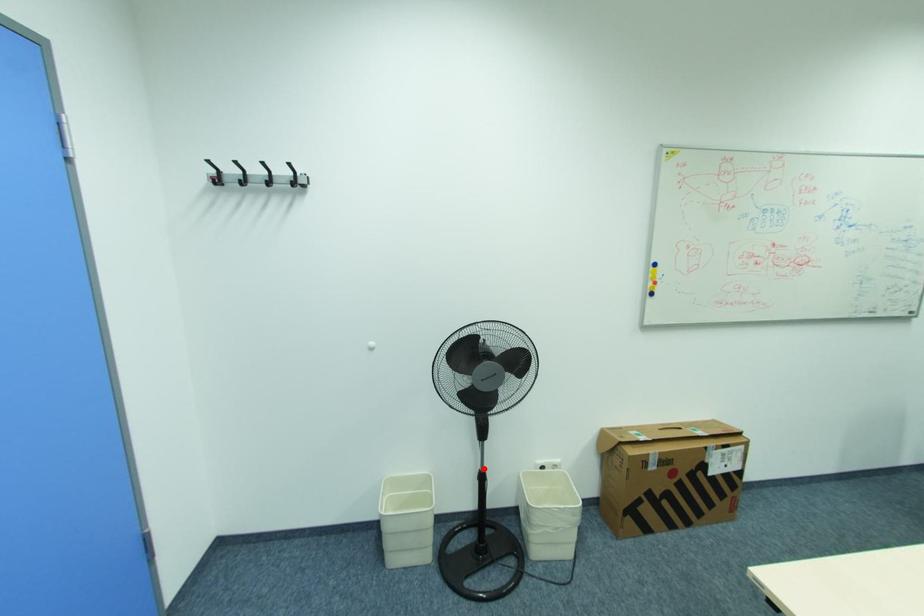
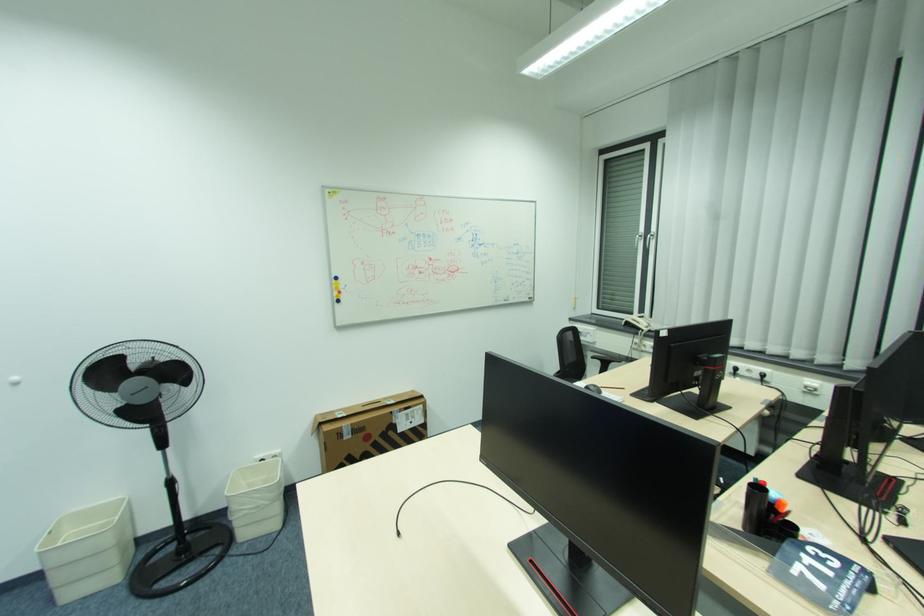
Question: A red point is marked in image1. In image2, is the corresponding 3D point closer to the camera or farther? Reply with the corresponding letter.

Choices:
 (A) The corresponding 3D point is closer.
 (B) The corresponding 3D point is farther.

Answer: (A)